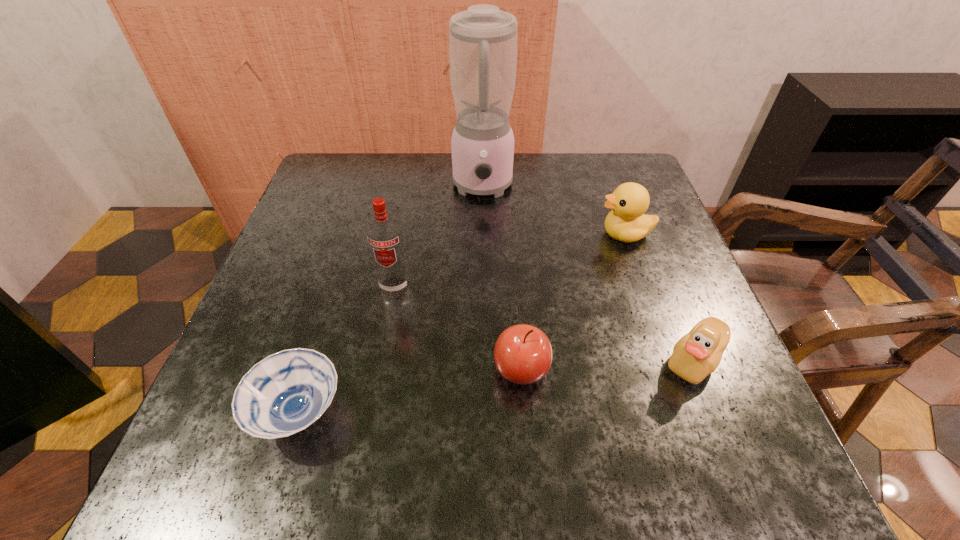
The height and width of the screenshot is (540, 960). What are the coordinates of `vacant area situated 0.200m on the base of the food processor near the control knob` in the screenshot? It's located at (483, 271).

This screenshot has width=960, height=540. I want to click on vacant space situated 0.110m on the front label of the fifth shortest object, so click(384, 345).

Locate an element on the screen. This screenshot has width=960, height=540. free space located on the face of the farther duck is located at coordinates (569, 234).

The height and width of the screenshot is (540, 960). I want to click on vacant space situated on the face of the farther duck, so [x=502, y=234].

You are a GUI agent. You are given a task and a screenshot of the screen. Output one action in this format:
    pyautogui.click(x=<x>, y=<y>)
    Task: Click on the free space located on the face of the farther duck
    The image size is (960, 540).
    Given the screenshot: What is the action you would take?
    pyautogui.click(x=520, y=234)

You are a GUI agent. You are given a task and a screenshot of the screen. Output one action in this format:
    pyautogui.click(x=<x>, y=<y>)
    Task: Click on the blank space located on the left of the apple
    
    Given the screenshot: What is the action you would take?
    pyautogui.click(x=274, y=369)

Where is `vacant area situated at the beak of the nearer duck`? The width and height of the screenshot is (960, 540). vacant area situated at the beak of the nearer duck is located at coordinates (603, 360).

Find the location of a particular element. Image resolution: width=960 pixels, height=540 pixels. free space located 0.370m at the beak of the nearer duck is located at coordinates (445, 360).

Where is `blank space located 0.150m at the beak of the nearer duck`? The image size is (960, 540). blank space located 0.150m at the beak of the nearer duck is located at coordinates (574, 360).

The height and width of the screenshot is (540, 960). I want to click on free space located 0.100m on the right of the leftmost object, so click(410, 412).